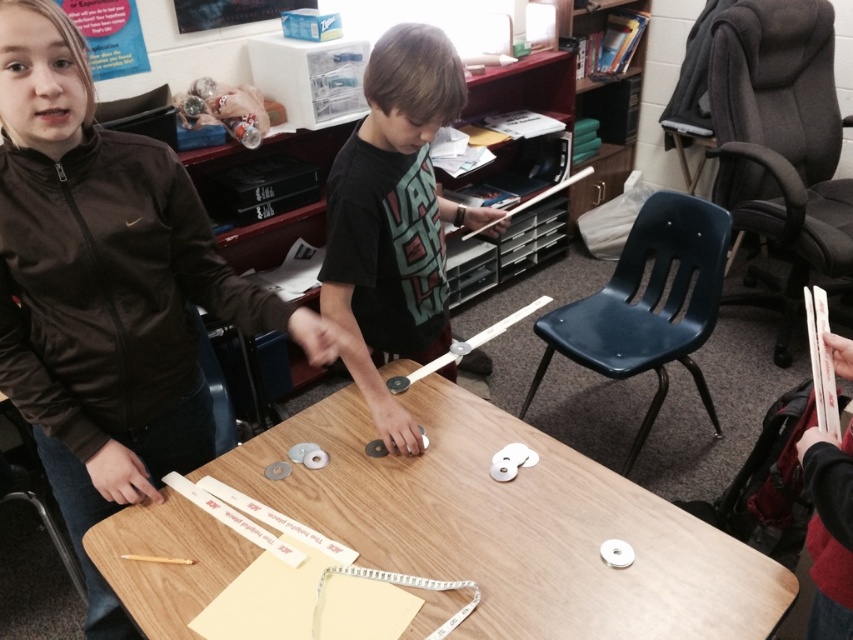
Question: Which object is the farthest from the black matte shirt at center?

Choices:
 (A) matte black chair at lower left
 (B) brown matte jacket at upper left

Answer: (A)

Question: Can you confirm if dark gray fabric office chair at right is bigger than matte black chair at lower left?

Choices:
 (A) no
 (B) yes

Answer: (B)

Question: Observing the image, what is the correct spatial positioning of brown matte jacket at upper left in reference to dark gray fabric office chair at right?

Choices:
 (A) left
 (B) right

Answer: (A)

Question: Which of these objects is positioned farthest from the wooden table at center?

Choices:
 (A) dark gray fabric office chair at right
 (B) matte black chair at lower left

Answer: (A)

Question: Which object is closer to the camera taking this photo?

Choices:
 (A) black matte shirt at center
 (B) dark gray fabric office chair at right
 (C) wooden table at center

Answer: (C)

Question: Considering the relative positions of wooden table at center and brown matte jacket at upper left in the image provided, where is wooden table at center located with respect to brown matte jacket at upper left?

Choices:
 (A) left
 (B) right

Answer: (B)